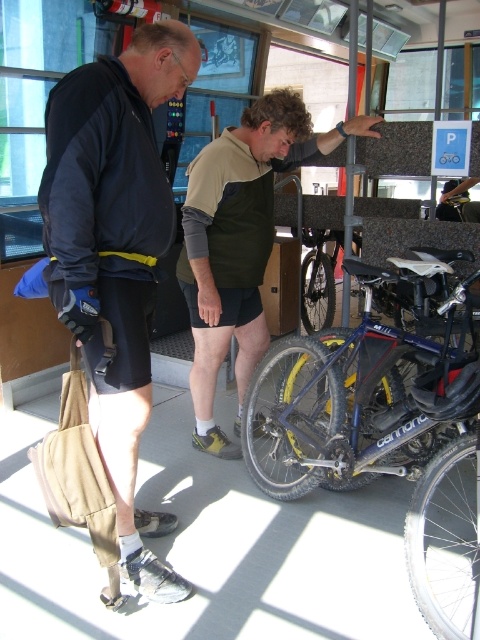
Question: Which object is the closest to the green fabric apron at center?

Choices:
 (A) blue metallic bicycle at center
 (B) shiny metallic bicycle at center

Answer: (A)

Question: Considering the relative positions of matte black jacket at left and green fabric apron at center in the image provided, where is matte black jacket at left located with respect to green fabric apron at center?

Choices:
 (A) above
 (B) below

Answer: (B)

Question: Which object is the closest to the blue metallic bicycle at center?

Choices:
 (A) green fabric apron at center
 (B) matte black jacket at left

Answer: (A)

Question: Does matte black jacket at left appear on the left side of blue metallic bicycle at center?

Choices:
 (A) no
 (B) yes

Answer: (B)

Question: Does blue metallic bicycle at center have a smaller size compared to shiny metallic bicycle at center?

Choices:
 (A) yes
 (B) no

Answer: (B)

Question: Which of the following is the closest to the observer?

Choices:
 (A) green fabric apron at center
 (B) blue metallic bicycle at center
 (C) matte black jacket at left
 (D) shiny metallic bicycle at center

Answer: (C)